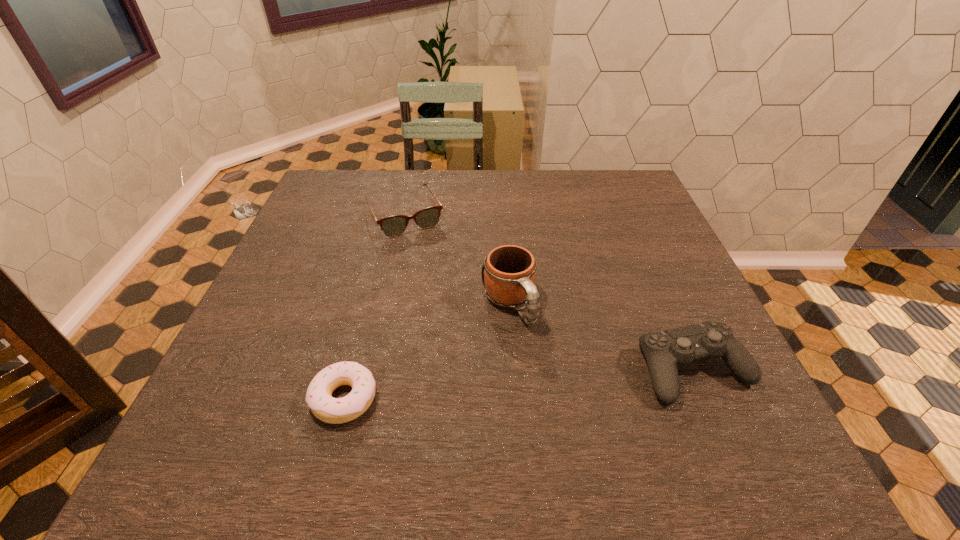
Locate an element on the screen. Image resolution: width=960 pixels, height=540 pixels. vacant space situated 0.360m at the front view of the farthest object is located at coordinates (468, 332).

Locate an element on the screen. This screenshot has height=540, width=960. free location located at the front view of the farthest object is located at coordinates (x=423, y=249).

Where is `vacant position located 0.180m on the side of the third object from left to right with the handle`? The image size is (960, 540). vacant position located 0.180m on the side of the third object from left to right with the handle is located at coordinates (564, 398).

At what (x,y) coordinates should I click in order to perform the action: click on vacant space situated 0.190m on the side of the third object from left to right with the handle. Please return your answer as a coordinate pair (x, y). The width and height of the screenshot is (960, 540). Looking at the image, I should click on (567, 402).

Where is `object at the far edge`? object at the far edge is located at coordinates (395, 225).

The height and width of the screenshot is (540, 960). I want to click on doughnut that is at the near edge, so click(319, 398).

The image size is (960, 540). I want to click on control present at the near edge, so click(664, 350).

The image size is (960, 540). Find the location of `object situated at the right edge`. object situated at the right edge is located at coordinates (664, 350).

Identify the location of object present at the near right corner. The height and width of the screenshot is (540, 960). (664, 350).

I want to click on vacant space at the far edge of the desktop, so click(381, 186).